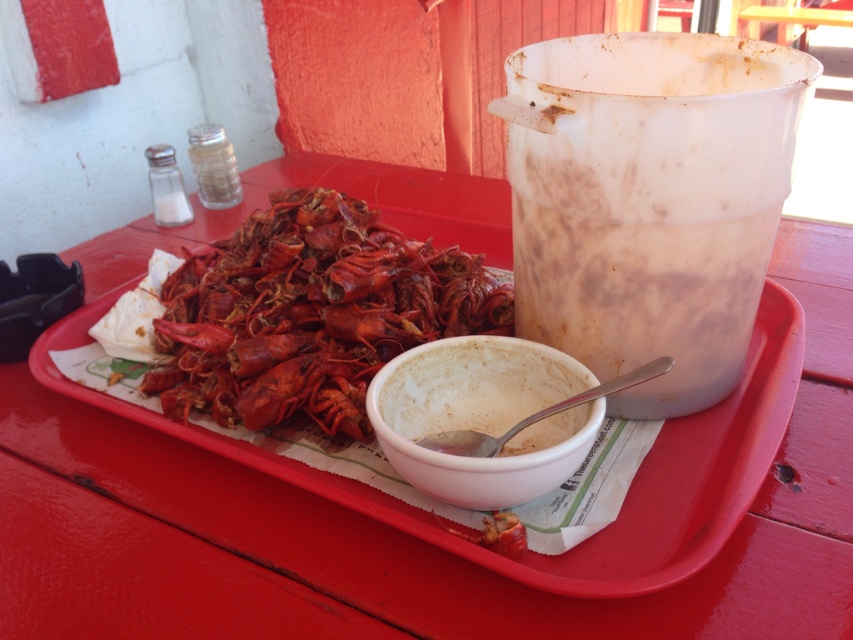
Does shiny red lobster at center come behind matte white bowl at center?

Yes, it is.

Who is taller, shiny red lobster at center or matte white bowl at center?

Standing taller between the two is shiny red lobster at center.

At what (x,y) coordinates should I click in order to perform the action: click on shiny red lobster at center. Please return your answer as a coordinate pair (x, y). Looking at the image, I should click on (310, 310).

Is matte white bowl at center below white matte bowl at center?

Incorrect, matte white bowl at center is not positioned below white matte bowl at center.

Who is more forward, (747, 364) or (488, 404)?

Positioned in front is point (488, 404).

Is point (682, 564) more distant than point (479, 460)?

Yes, point (682, 564) is farther from viewer.

Identify the location of matte white bowl at center. The height and width of the screenshot is (640, 853). (625, 499).

Does shiny red lobster at center lie in front of white matte bowl at center?

No, it is not.

Who is higher up, shiny red lobster at center or white matte bowl at center?

shiny red lobster at center is above.

Who is more forward, (265, 323) or (566, 422)?

Positioned in front is point (566, 422).

In order to click on shiny red lobster at center in this screenshot , I will do `click(310, 310)`.